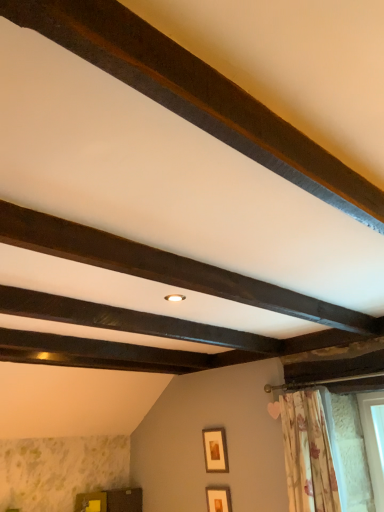
Question: Can you confirm if wooden cabinet at lower left is bigger than dark brown wood at upper center, positioned as the second plank in bottom-to-top order?

Choices:
 (A) yes
 (B) no

Answer: (A)

Question: Is wooden cabinet at lower left outside of dark brown wood at upper center, positioned as the second plank in bottom-to-top order?

Choices:
 (A) yes
 (B) no

Answer: (A)

Question: Does wooden cabinet at lower left come behind dark brown wood at upper center, the 1th plank from the top?

Choices:
 (A) yes
 (B) no

Answer: (A)

Question: Is wooden cabinet at lower left wider than dark brown wood at upper center, the 1th plank from the top?

Choices:
 (A) yes
 (B) no

Answer: (A)

Question: Is wooden cabinet at lower left at the left side of dark brown wood at upper center, positioned as the second plank in bottom-to-top order?

Choices:
 (A) no
 (B) yes

Answer: (B)

Question: Is wooden cabinet at lower left shorter than dark brown wood at upper center, positioned as the first plank in front-to-back order?

Choices:
 (A) yes
 (B) no

Answer: (B)

Question: Considering the relative positions of matte gold picture frame at lower center, which is the first picture frame in bottom-to-top order, and floral fabric curtain at lower right in the image provided, is matte gold picture frame at lower center, which is the first picture frame in bottom-to-top order, to the right of floral fabric curtain at lower right from the viewer's perspective?

Choices:
 (A) yes
 (B) no

Answer: (B)

Question: From the image's perspective, is matte gold picture frame at lower center, which is the first picture frame in bottom-to-top order, above floral fabric curtain at lower right?

Choices:
 (A) yes
 (B) no

Answer: (B)

Question: Is matte gold picture frame at lower center, which is the first picture frame in bottom-to-top order, further to camera compared to floral fabric curtain at lower right?

Choices:
 (A) no
 (B) yes

Answer: (B)

Question: Does matte gold picture frame at lower center, which is the first picture frame in bottom-to-top order, have a lesser height compared to floral fabric curtain at lower right?

Choices:
 (A) yes
 (B) no

Answer: (A)

Question: Is matte gold picture frame at lower center, which is the first picture frame in bottom-to-top order, in front of floral fabric curtain at lower right?

Choices:
 (A) no
 (B) yes

Answer: (A)

Question: Would you consider matte gold picture frame at lower center, arranged as the second picture frame when viewed from the top, to be distant from floral fabric curtain at lower right?

Choices:
 (A) yes
 (B) no

Answer: (B)

Question: Is wooden picture frame at center, arranged as the second picture frame when ordered from the bottom, to the left of floral fabric curtain at lower right from the viewer's perspective?

Choices:
 (A) no
 (B) yes

Answer: (B)